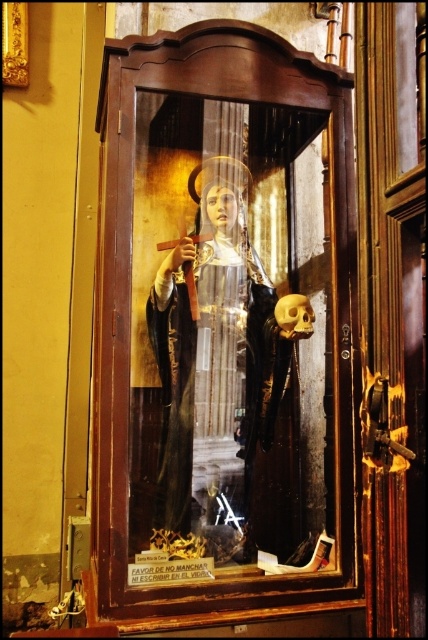
You are an interior designer planning to place a new sculpture on the right side of the wooden cabinet at center. Given the current arrangement, where should the sculpture be positioned relative to the matte black robe at center?

The wooden cabinet at center is to the left of the matte black robe at center, so placing the sculpture on the right side of the wooden cabinet at center would position it directly next to the matte black robe at center.

You are an interior designer planning to place a 4.53 inch wide decorative item between the wooden cabinet at center and the matte black robe at center. Will there be enough space to fit it without overlapping either object?

The wooden cabinet at center and the matte black robe at center are exactly 4.53 inches apart, so the 4.53 inch wide decorative item will fit perfectly between them without overlapping either object.

You are standing in front of the religious figure in the wooden display case. There are two points marked on the display case. One is at coordinate point (124,387) and the other is at point (171,392). Which point is closer to you?

Point (124,387) is closer to the viewer than point (171,392).